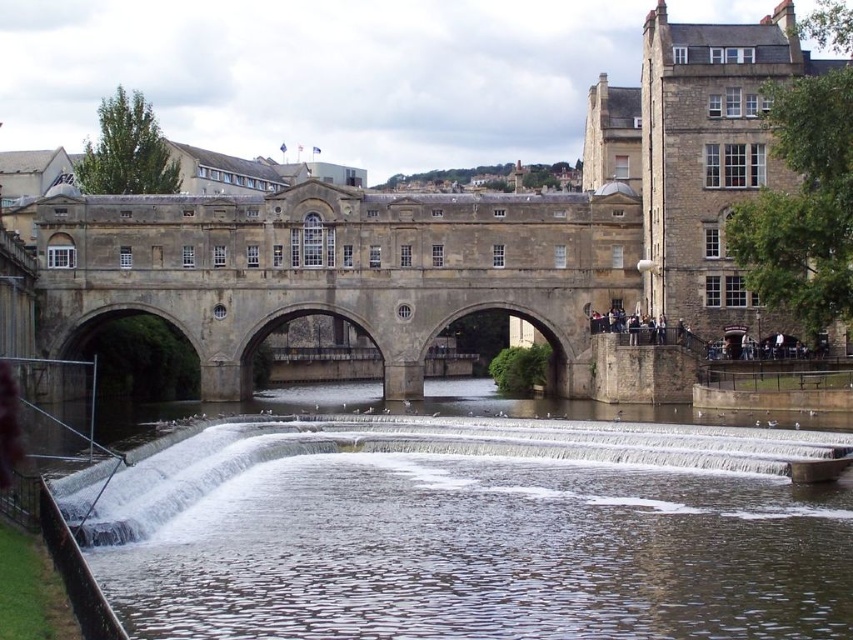
You are standing on the bank of the brown stone river at lower center and want to reach the stone bridge at center. Based on their heights, which one is higher?

The stone bridge at center is higher than the brown stone river at lower center.

What are the coordinates of the brown stone river at lower center?

The brown stone river at lower center is located at coordinates point [474,529].